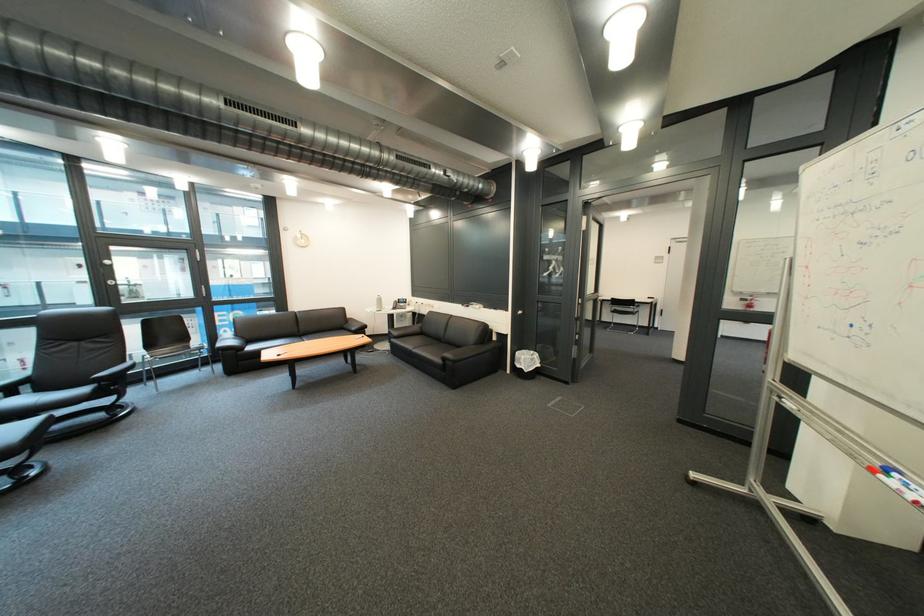
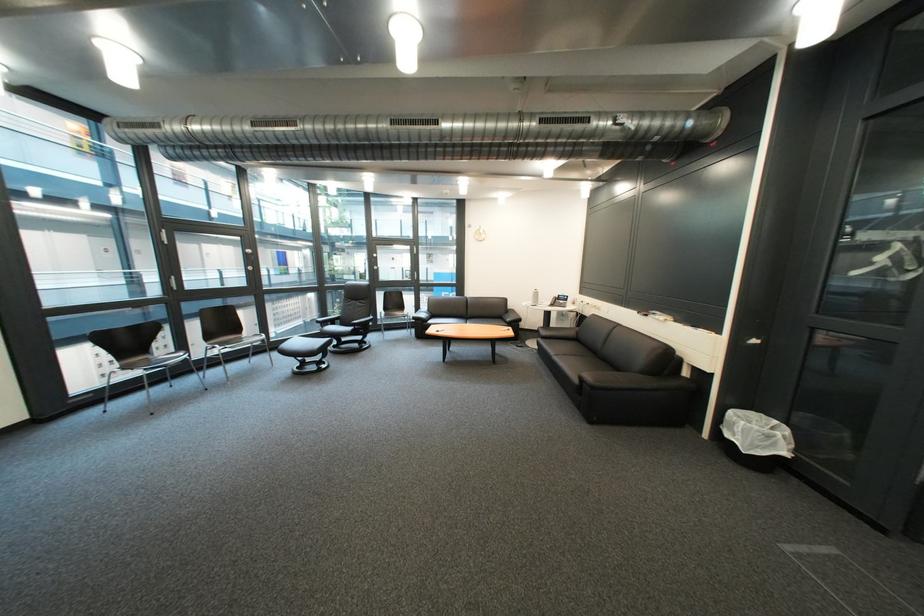
Find the pixel in the second image that matches point (409, 339) in the first image.

(556, 339)